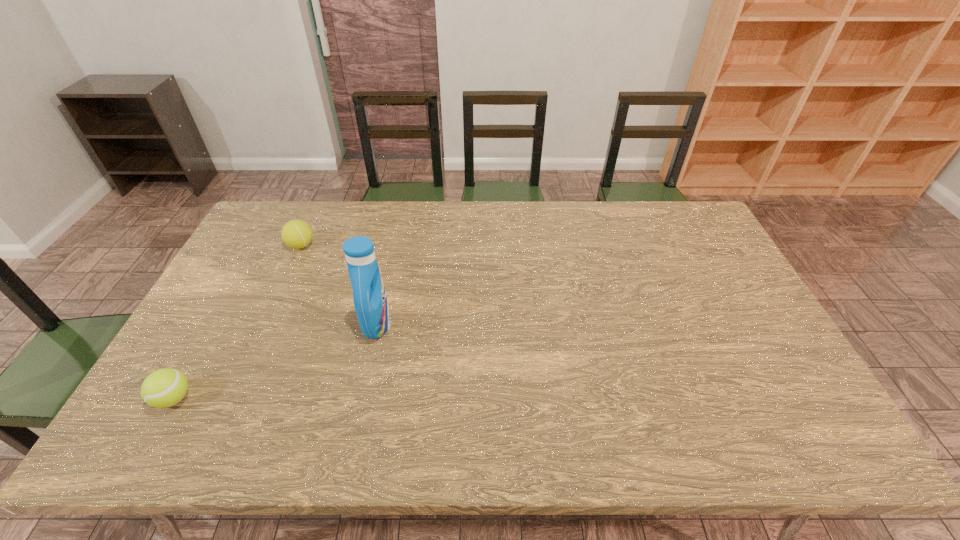
This screenshot has width=960, height=540. What are the coordinates of `object present at the far left corner` in the screenshot? It's located at (296, 234).

Identify the location of vacant space at the far edge of the desktop. This screenshot has width=960, height=540. (483, 217).

The width and height of the screenshot is (960, 540). In order to click on vacant space at the near edge in this screenshot , I will do `click(391, 435)`.

The width and height of the screenshot is (960, 540). In the image, there is a desktop. What are the coordinates of `free space at the left edge` in the screenshot? It's located at (258, 274).

Image resolution: width=960 pixels, height=540 pixels. I want to click on vacant space at the right edge of the desktop, so click(765, 374).

Find the location of a particular element. The height and width of the screenshot is (540, 960). vacant space at the far left corner of the desktop is located at coordinates (306, 201).

The width and height of the screenshot is (960, 540). Identify the location of vacant region at the near left corner of the desktop. (204, 429).

I want to click on free space that is in between the nearest object and the right tennis ball, so click(237, 322).

Locate an element on the screen. Image resolution: width=960 pixels, height=540 pixels. empty space that is in between the farthest object and the second nearest object is located at coordinates (339, 285).

You are a GUI agent. You are given a task and a screenshot of the screen. Output one action in this format:
    pyautogui.click(x=<x>, y=<y>)
    Task: Click on the empty space that is in between the nearest object and the farthest object
    
    Given the screenshot: What is the action you would take?
    pyautogui.click(x=237, y=322)